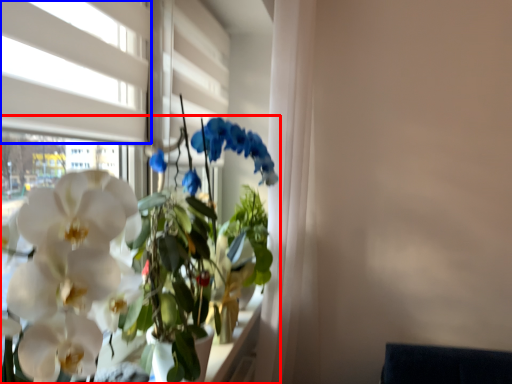
Question: Among these objects, which one is nearest to the camera, houseplant (highlighted by a red box) or window (highlighted by a blue box)?

Choices:
 (A) houseplant
 (B) window

Answer: (A)